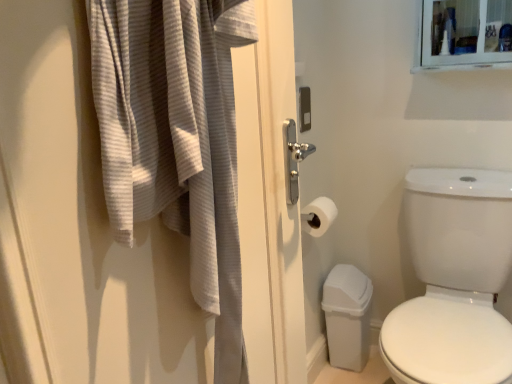
Question: From a real-world perspective, is white glossy toilet at right located higher than white matte toilet paper at center?

Choices:
 (A) no
 (B) yes

Answer: (A)

Question: Considering the relative sizes of white glossy toilet at right and white matte toilet paper at center in the image provided, is white glossy toilet at right smaller than white matte toilet paper at center?

Choices:
 (A) no
 (B) yes

Answer: (A)

Question: Can white matte toilet paper at center be found inside white glossy toilet at right?

Choices:
 (A) yes
 (B) no

Answer: (B)

Question: Considering the relative positions of white glossy toilet at right and white matte toilet paper at center in the image provided, is white glossy toilet at right to the right of white matte toilet paper at center from the viewer's perspective?

Choices:
 (A) no
 (B) yes

Answer: (B)

Question: Is the depth of white glossy toilet at right greater than that of white matte toilet paper at center?

Choices:
 (A) yes
 (B) no

Answer: (B)

Question: Does point (328, 205) appear closer or farther from the camera than point (123, 157)?

Choices:
 (A) closer
 (B) farther

Answer: (B)

Question: Is white matte toilet paper at center in front of or behind gray textured bath towel at left in the image?

Choices:
 (A) front
 (B) behind

Answer: (B)

Question: Would you say white matte toilet paper at center is to the left or to the right of gray textured bath towel at left in the picture?

Choices:
 (A) right
 (B) left

Answer: (A)

Question: From the image's perspective, relative to gray textured bath towel at left, is white matte toilet paper at center above or below?

Choices:
 (A) above
 (B) below

Answer: (B)

Question: Considering the positions of point (91, 3) and point (498, 177), is point (91, 3) closer or farther from the camera than point (498, 177)?

Choices:
 (A) farther
 (B) closer

Answer: (B)

Question: In terms of width, does gray textured bath towel at left look wider or thinner when compared to white glossy toilet at right?

Choices:
 (A) thin
 (B) wide

Answer: (A)

Question: From the image's perspective, is gray textured bath towel at left positioned above or below white glossy toilet at right?

Choices:
 (A) below
 (B) above

Answer: (B)

Question: Based on their sizes in the image, would you say gray textured bath towel at left is bigger or smaller than white glossy toilet at right?

Choices:
 (A) big
 (B) small

Answer: (B)

Question: Considering their positions, is white glossy toilet at right located in front of or behind white matte toilet paper at center?

Choices:
 (A) behind
 (B) front

Answer: (B)

Question: In terms of width, does white glossy toilet at right look wider or thinner when compared to white matte toilet paper at center?

Choices:
 (A) thin
 (B) wide

Answer: (B)